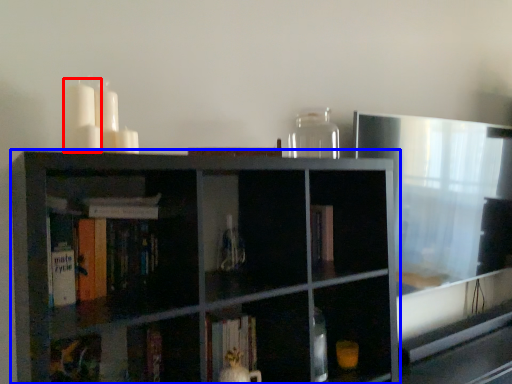
Question: Among these objects, which one is nearest to the camera, candle (highlighted by a red box) or shelf (highlighted by a blue box)?

Choices:
 (A) candle
 (B) shelf

Answer: (B)